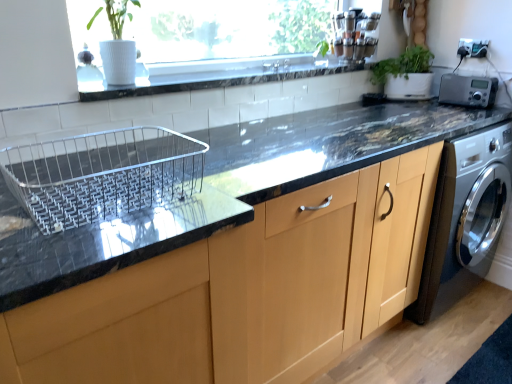
Question: Considering the positions of point (163, 77) and point (476, 87), is point (163, 77) closer or farther from the camera than point (476, 87)?

Choices:
 (A) closer
 (B) farther

Answer: (A)

Question: In terms of height, does white tile at upper center look taller or shorter compared to silver metallic radio at upper right?

Choices:
 (A) short
 (B) tall

Answer: (A)

Question: Estimate the real-world distances between objects in this image. Which object is closer to the matte wood cabinet at center?

Choices:
 (A) green matte plant at upper right
 (B) white tile at upper center
 (C) silver metallic radio at upper right

Answer: (B)

Question: Estimate the real-world distances between objects in this image. Which object is farther from the white tile at upper center?

Choices:
 (A) green matte plant at upper right
 (B) matte wood cabinet at center
 (C) silver metallic radio at upper right

Answer: (B)